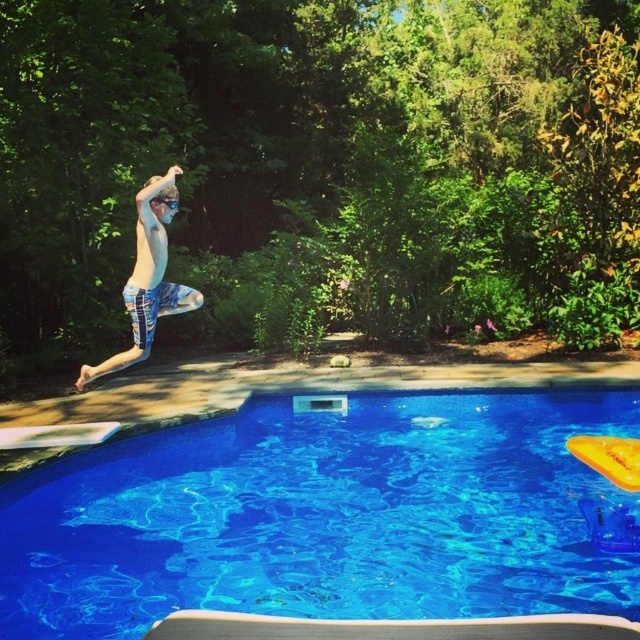
You are a photographer trying to capture the subject wearing the blue printed shorts at center and the black plastic goggles at upper center. Which object should you focus on first if you want to emphasize the larger one in your photo?

The blue printed shorts at center has a larger size compared to black plastic goggles at upper center, so you should focus on the blue printed shorts at center first to emphasize its larger size in the photo.